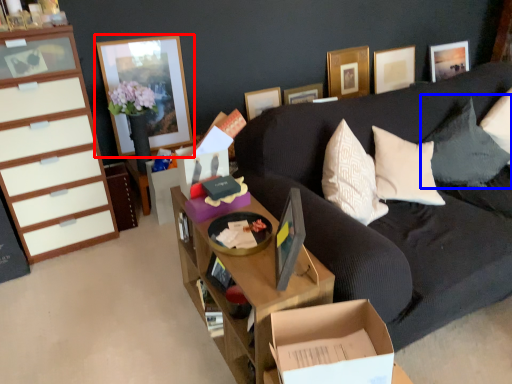
Question: Which of the following is the farthest to the observer, picture frame (highlighted by a red box) or pillow (highlighted by a blue box)?

Choices:
 (A) picture frame
 (B) pillow

Answer: (A)